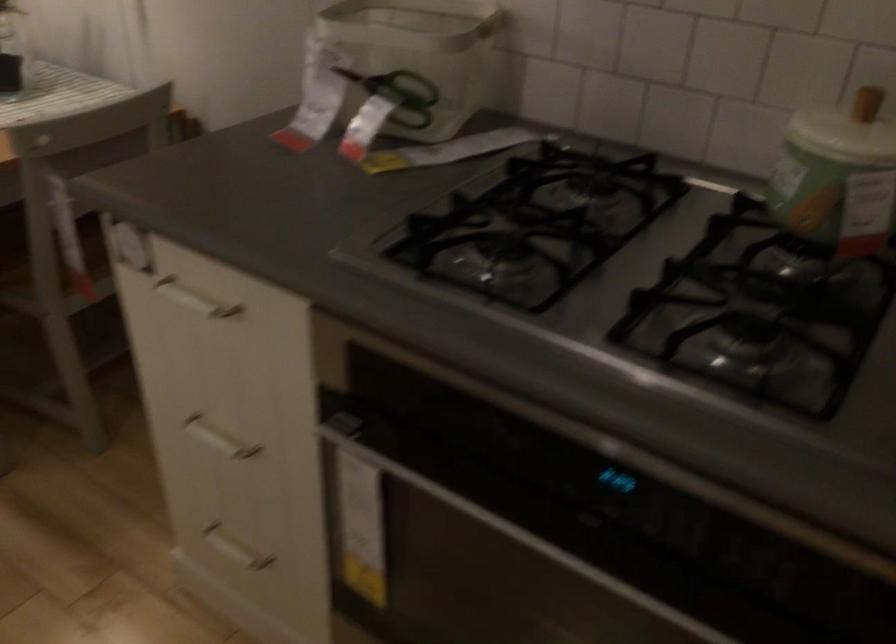
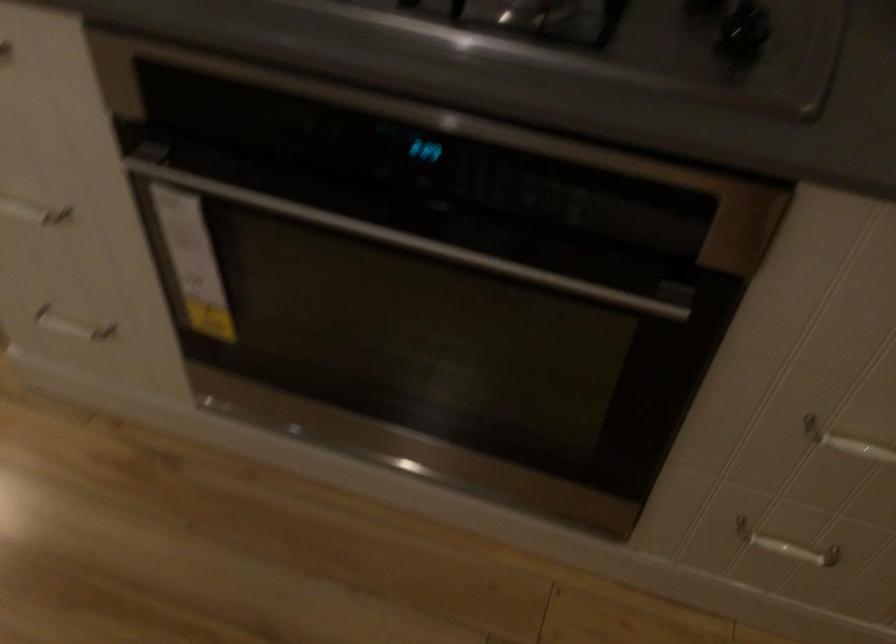
Question: The images are taken continuously from a first-person perspective. In which direction are you moving?

Choices:
 (A) Left
 (B) Right
 (C) Forward
 (D) Backward

Answer: (D)